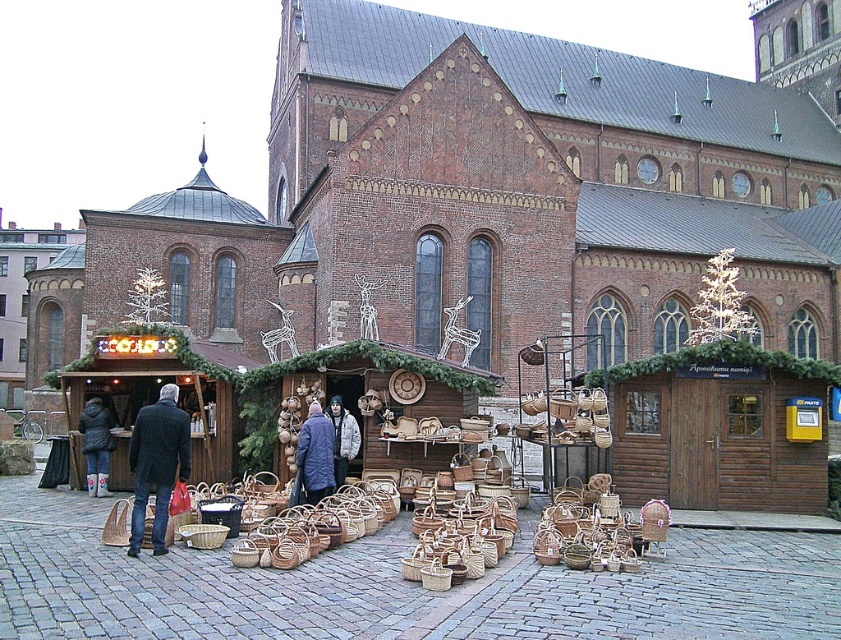
Does blue quilted coat at center have a larger size compared to white rubber boots at lower left?

Yes, blue quilted coat at center is bigger than white rubber boots at lower left.

Which of these two, blue quilted coat at center or white rubber boots at lower left, stands shorter?

blue quilted coat at center is shorter.

Find the location of a particular element. The image size is (841, 640). blue quilted coat at center is located at coordinates (313, 458).

Where is `blue quilted coat at center`? The image size is (841, 640). blue quilted coat at center is located at coordinates (313, 458).

Image resolution: width=841 pixels, height=640 pixels. I want to click on blue quilted coat at center, so click(x=313, y=458).

Who is higher up, blue quilted coat at center or white puffy jacket at center?

white puffy jacket at center

Between point (320, 477) and point (342, 428), which one is positioned behind?

The point (342, 428) is more distant.

In order to click on blue quilted coat at center in this screenshot , I will do `click(313, 458)`.

Consider the image. Can you confirm if dark blue coat at center is positioned to the left of white rubber boots at lower left?

Incorrect, dark blue coat at center is not on the left side of white rubber boots at lower left.

Who is higher up, dark blue coat at center or white rubber boots at lower left?

dark blue coat at center is higher up.

Is point (156, 486) more distant than point (82, 448)?

No, (156, 486) is closer to viewer.

In order to click on dark blue coat at center in this screenshot , I will do `click(157, 464)`.